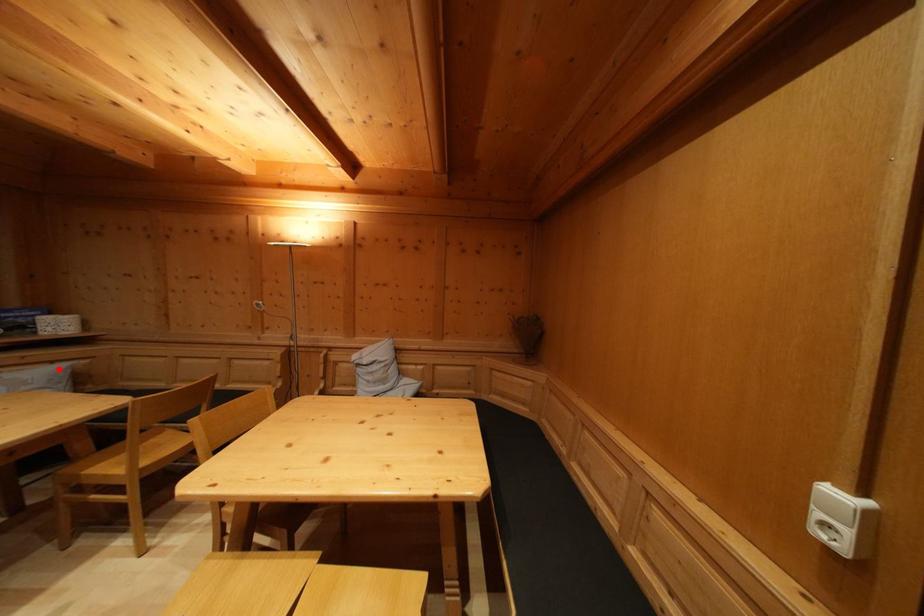
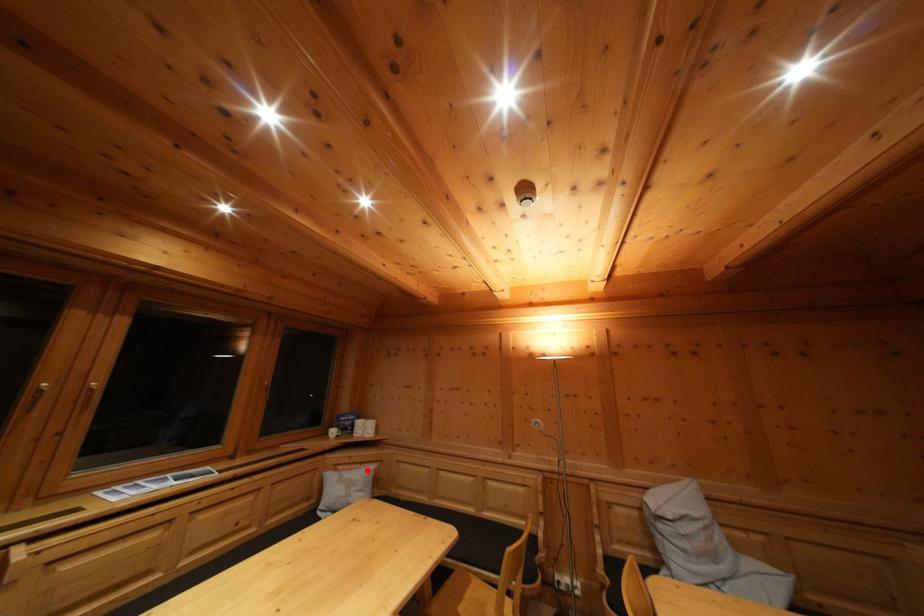
I am providing you with two images of the same scene from different viewpoints. A red point is marked on the first image and another point is marked on the second image. Are the points marked in image1 and image2 representing the same 3D position?

Yes